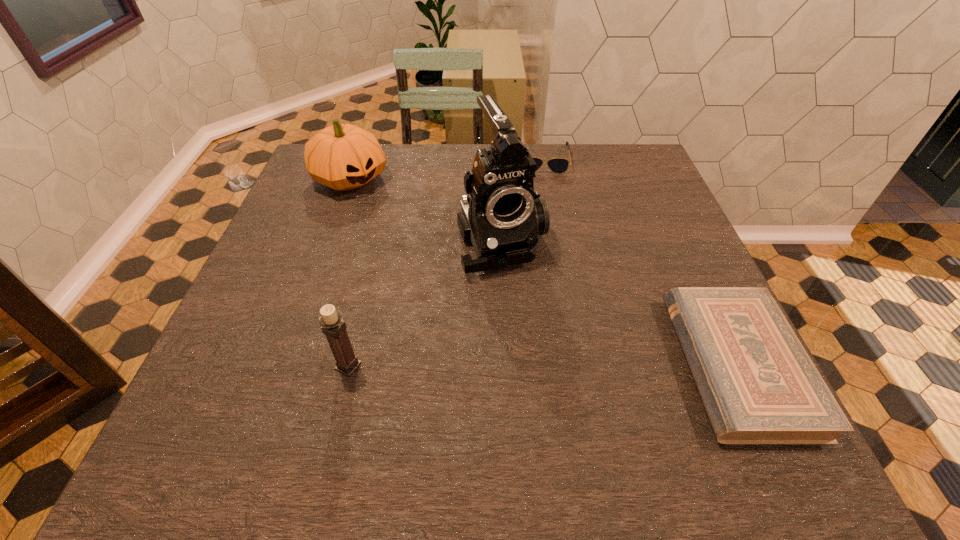
This screenshot has height=540, width=960. Identify the location of sunglasses that is at the far edge. (557, 165).

The image size is (960, 540). In order to click on candle holder that is at the near edge in this screenshot , I will do `click(332, 325)`.

I want to click on Bible located in the near edge section of the desktop, so click(x=758, y=385).

Find the location of a particular element. object that is at the left edge is located at coordinates (343, 157).

The width and height of the screenshot is (960, 540). What are the coordinates of `object at the right edge` in the screenshot? It's located at (758, 385).

Where is `object present at the far left corner`? The height and width of the screenshot is (540, 960). object present at the far left corner is located at coordinates (343, 157).

I want to click on object that is at the near right corner, so click(x=758, y=385).

This screenshot has width=960, height=540. I want to click on vacant space at the far edge of the desktop, so click(591, 159).

Locate an element on the screen. The height and width of the screenshot is (540, 960). vacant space at the left edge of the desktop is located at coordinates (253, 341).

In the image, there is a desktop. Identify the location of vacant region at the right edge. The height and width of the screenshot is (540, 960). (623, 202).